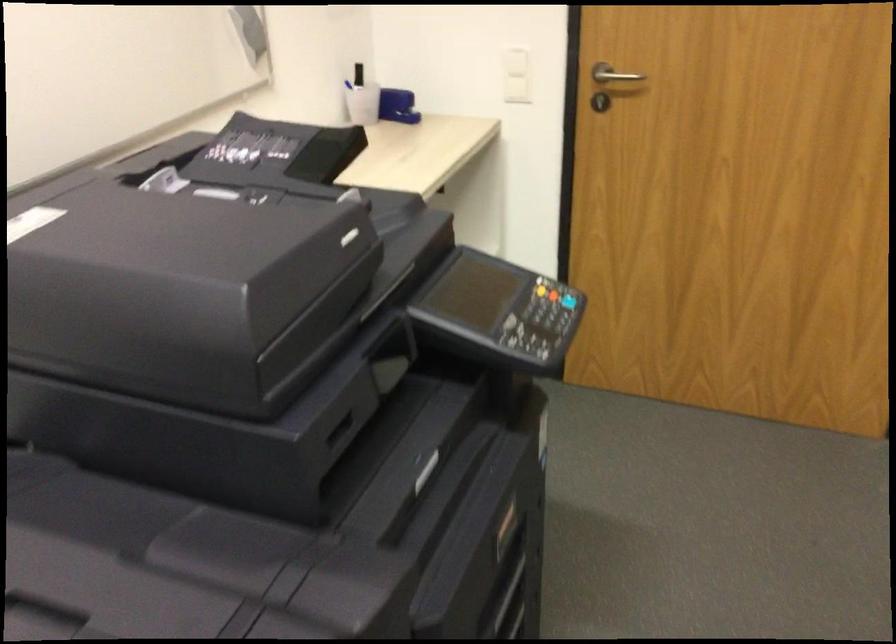
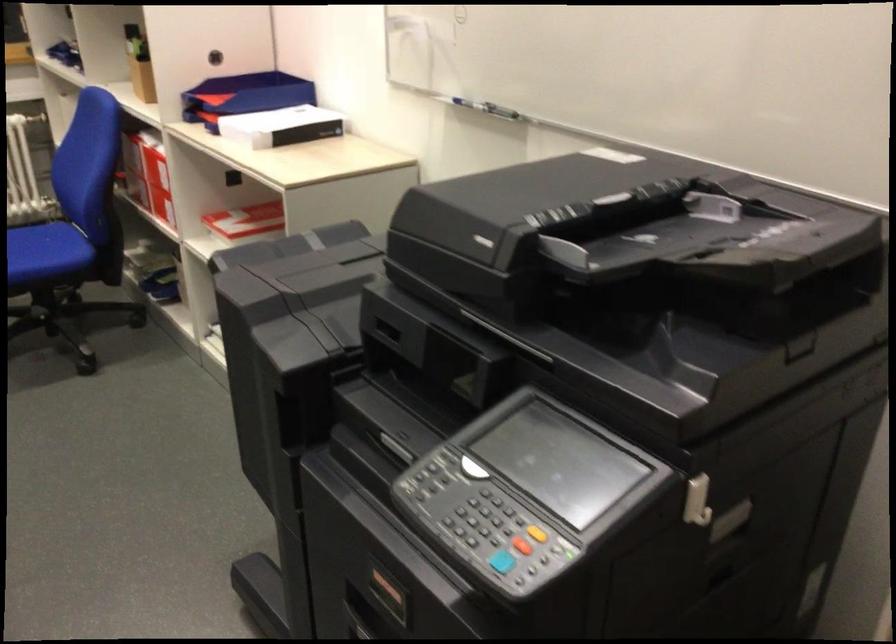
The point at (543, 353) is marked in the first image. Where is the corresponding point in the second image?

(470, 514)